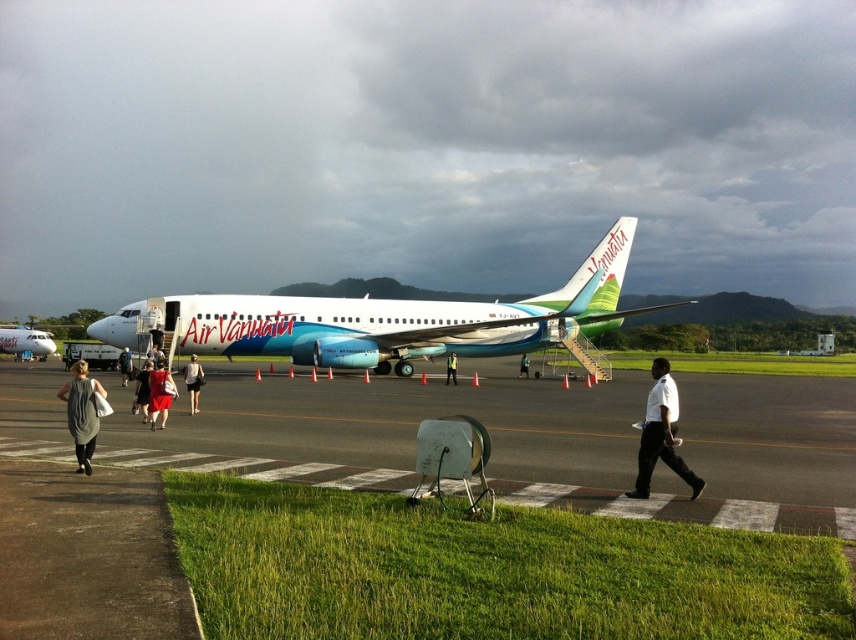
Question: Can you confirm if black asphalt runway at lower center is positioned below white glossy airplane at center?

Choices:
 (A) yes
 (B) no

Answer: (A)

Question: Which point is closer to the camera taking this photo?

Choices:
 (A) (88, 380)
 (B) (195, 385)
 (C) (128, 372)

Answer: (A)

Question: Is black asphalt runway at lower center positioned in front of yellow reflective vest at center?

Choices:
 (A) no
 (B) yes

Answer: (B)

Question: Estimate the real-world distances between objects in this image. Which object is farther from the denim shorts at center?

Choices:
 (A) white glossy airplane at center
 (B) matte white airplane at center

Answer: (B)

Question: Which of these objects is positioned closest to the black asphalt runway at lower center?

Choices:
 (A) gray fabric dress at lower left
 (B) matte red dress at center
 (C) dark gray dress at center

Answer: (C)

Question: Can you confirm if black asphalt runway at lower center is positioned to the left of gray fabric dress at lower left?

Choices:
 (A) yes
 (B) no

Answer: (B)